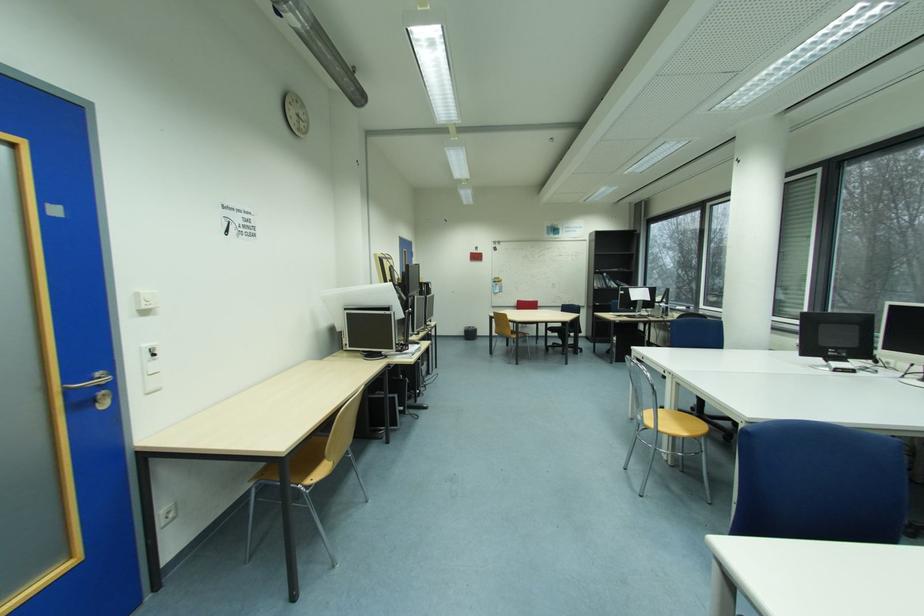
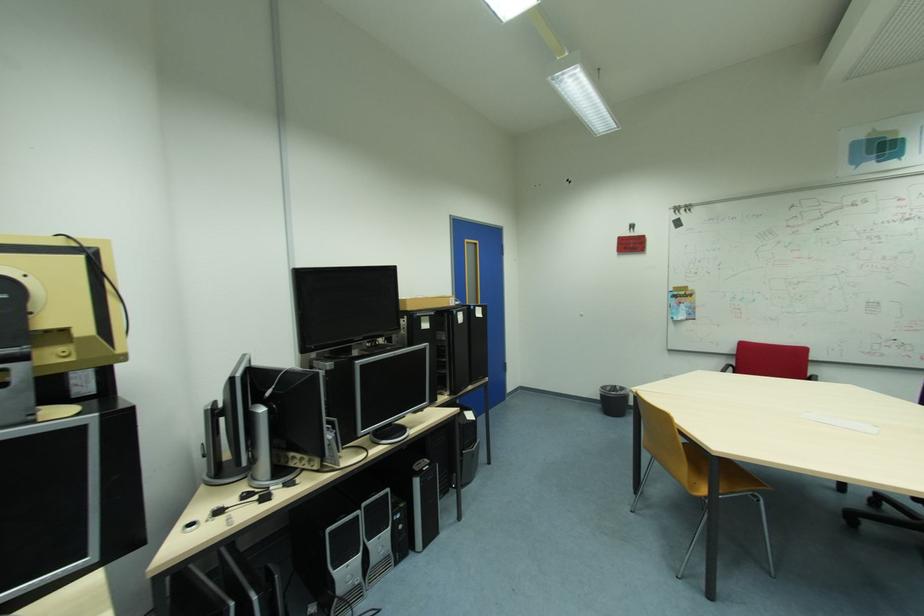
In the second image, find the point that corresponds to point 411,251 in the first image.

(473, 241)